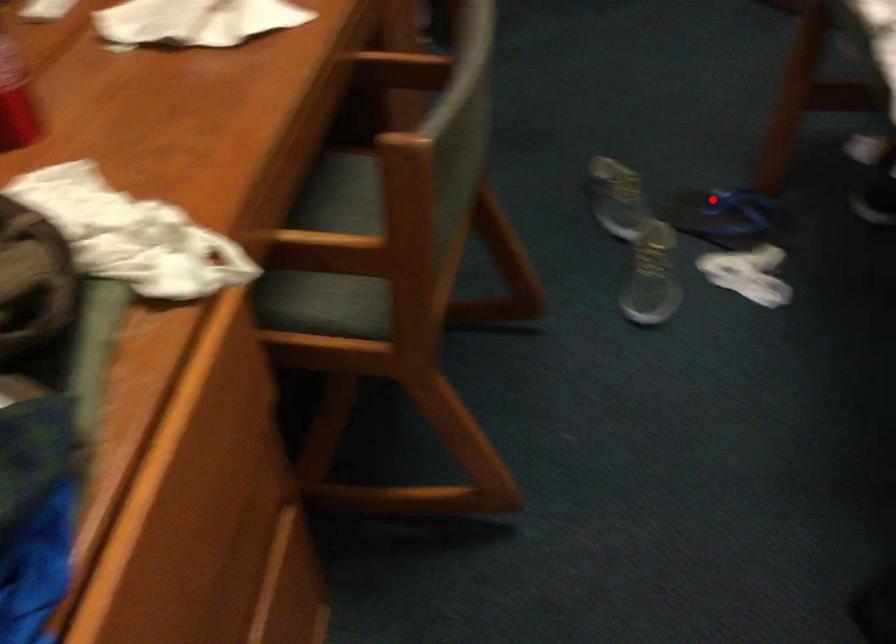
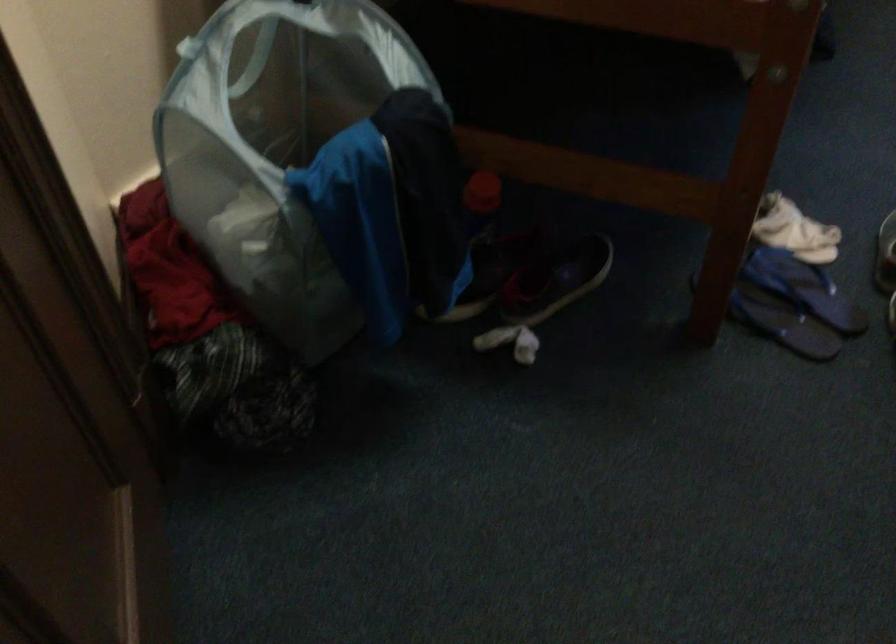
Question: I am providing you with two images of the same scene from different viewpoints. A red point is shown in image1. For the corresponding object point in image2, is it positioned nearer or farther from the camera?

Choices:
 (A) Nearer
 (B) Farther

Answer: (A)